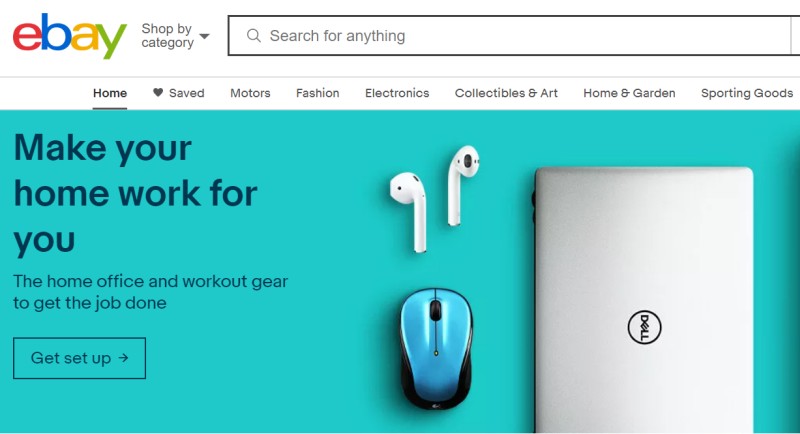
I want to click on laptop, so click(633, 297).